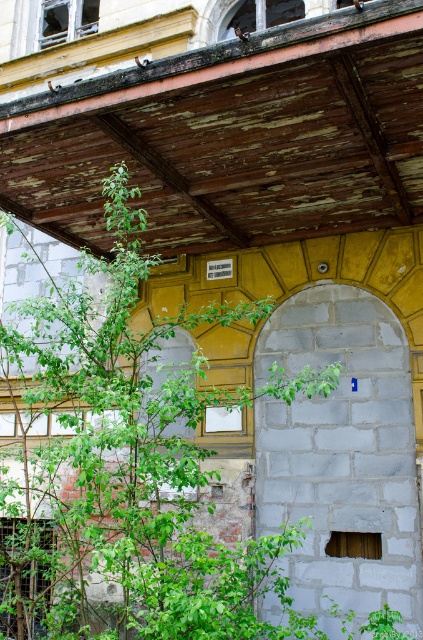
Does green leafy tree at center come behind gray stone pillar at center?

No.

Does point (170, 577) come farther from viewer compared to point (332, 497)?

That is False.

Find the location of `green leafy tree at center`. green leafy tree at center is located at coordinates (142, 454).

Image resolution: width=423 pixels, height=640 pixels. I want to click on green leafy tree at center, so click(x=142, y=454).